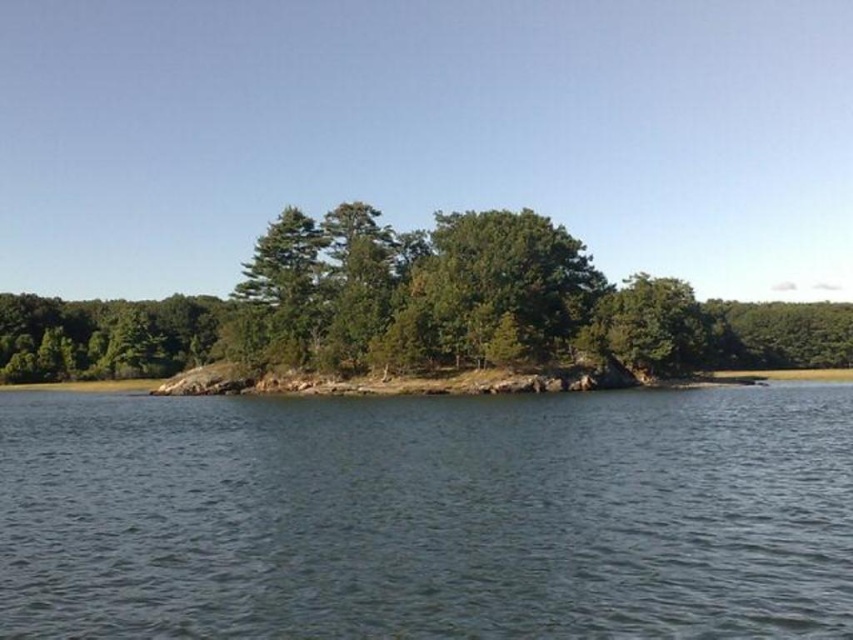
Is clear water at center below green leafy tree at center?

Yes.

Is clear water at center shorter than green leafy tree at center?

Yes.

This screenshot has width=853, height=640. What are the coordinates of `clear water at center` in the screenshot? It's located at (428, 516).

Identify the location of clear water at center. (428, 516).